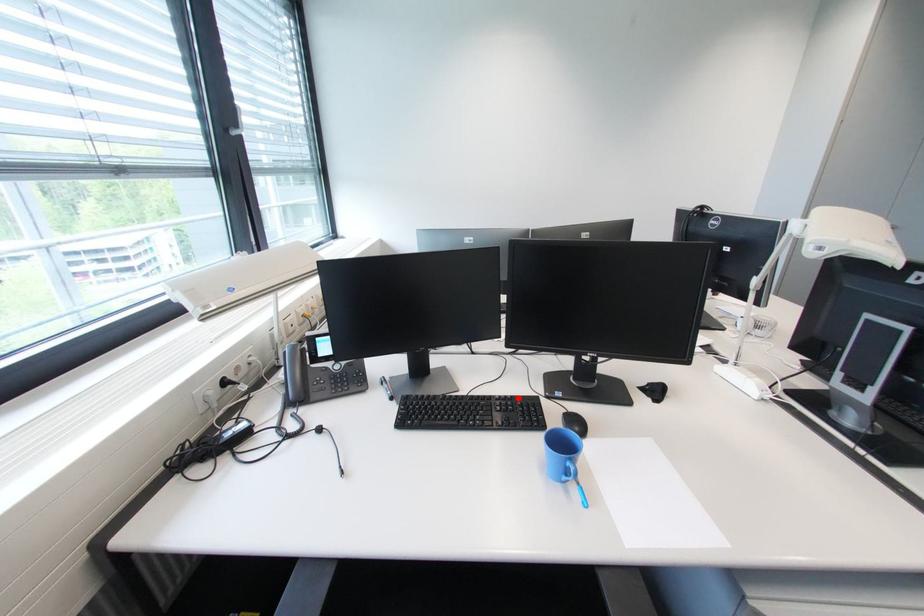
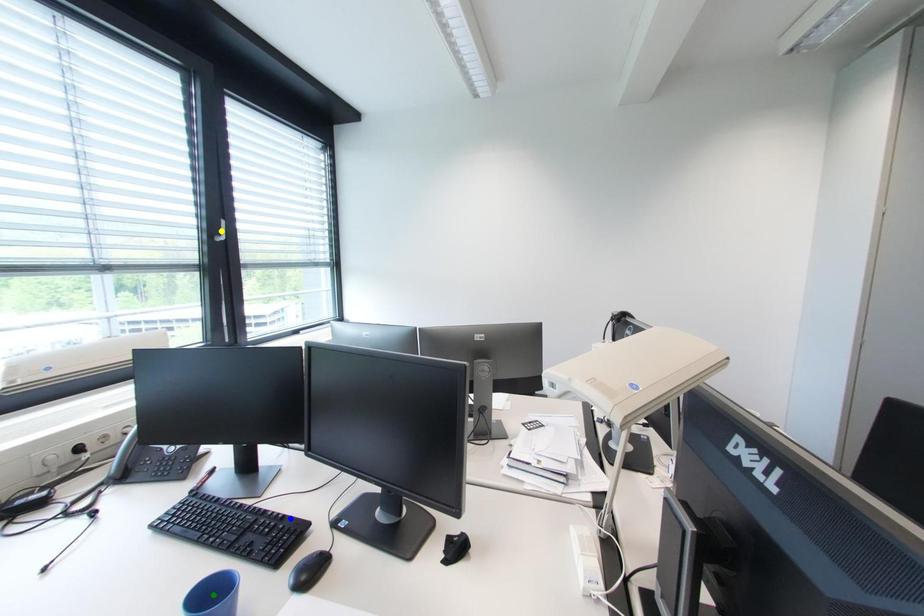
Question: I am providing you with two images of the same scene from different viewpoints. A red point is marked on the first image. You are given multiple points on the second image. Which spot in image 2 lines up with the point in image 1?

Choices:
 (A) green point
 (B) blue point
 (C) yellow point

Answer: (B)